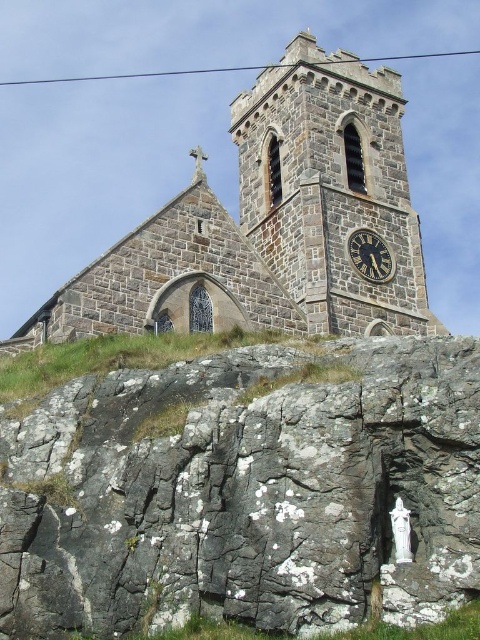
You are standing at the base of the rocky outcrop and looking up at the dark stone church at upper center. What are the coordinates of its position in the image?

The dark stone church at upper center is located at coordinates [275,218].

You are a construction worker planning to place a new statue that is 10 feet wide between the gray rough rock at lower center and the dark gray stone clock at center. Can the statue fit in the space between them?

The gray rough rock at lower center is 111.90 feet from dark gray stone clock at center. Since the statue is only 10 feet wide, there is sufficient space between them to accommodate the statue.

You are a bird flying over the rocky area. You want to land on the highest point available. Which object should you choose between the dark stone church at upper center and the dark gray stone clock at center?

The dark stone church at upper center is much taller than the dark gray stone clock at center, so you should land on the dark stone church at upper center to reach the highest point available.